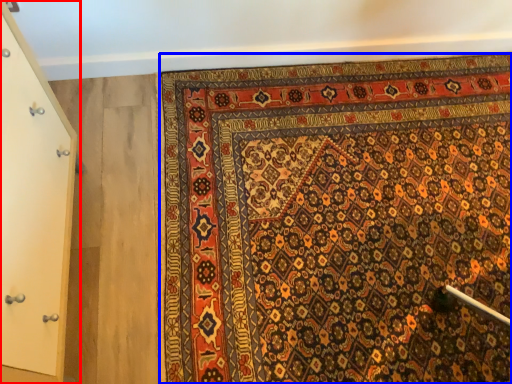
Question: Which object is closer to the camera taking this photo, door (highlighted by a red box) or mat (highlighted by a blue box)?

Choices:
 (A) door
 (B) mat

Answer: (A)